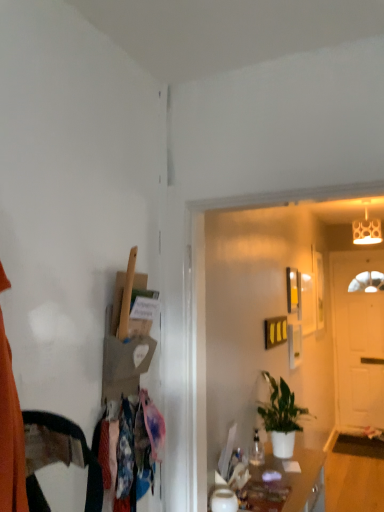
In order to face white matte door at right, should I rotate leftwards or rightwards?

You should rotate right by 21.567 degrees.

This screenshot has height=512, width=384. I want to click on floral fabric dress at left, so click(130, 450).

Describe the element at coordinates (318, 287) in the screenshot. Image resolution: width=384 pixels, height=512 pixels. I see `wooden picture frame at upper right` at that location.

Locate an element on the screen. green matte plant at center is located at coordinates (281, 417).

Find the location of a particular element. This screenshot has height=512, width=384. white matte door at right is located at coordinates (357, 340).

From a real-world perspective, is wooden picture frame at upper right above or below green matte plant at center?

From a real-world perspective, wooden picture frame at upper right is physically above green matte plant at center.

Considering the relative sizes of wooden picture frame at upper right and green matte plant at center in the image provided, is wooden picture frame at upper right taller than green matte plant at center?

Yes, wooden picture frame at upper right is taller than green matte plant at center.

Between wooden picture frame at upper right and green matte plant at center, which one has smaller size?

With smaller size is wooden picture frame at upper right.

Image resolution: width=384 pixels, height=512 pixels. I want to click on houseplant in front of the wooden picture frame at upper right, so (x=281, y=417).

Considering the positions of points (287, 426) and (321, 318), is point (287, 426) farther from camera compared to point (321, 318)?

No, (287, 426) is closer to viewer.

Is green matte plant at center inside or outside of wooden picture frame at upper right?

green matte plant at center lies outside wooden picture frame at upper right.

Is green matte plant at center at the right side of wooden picture frame at upper right?

In fact, green matte plant at center is to the left of wooden picture frame at upper right.

From the image's perspective, is green matte plant at center located above wooden picture frame at upper right?

No, from the image's perspective, green matte plant at center is not above wooden picture frame at upper right.

Is white matte door at right thinner than wooden picture frame at upper right?

In fact, white matte door at right might be wider than wooden picture frame at upper right.

Who is smaller, white matte door at right or wooden picture frame at upper right?

Smaller between the two is wooden picture frame at upper right.

Is wooden picture frame at upper right located within white matte door at right?

No, wooden picture frame at upper right is not surrounded by white matte door at right.

Is point (365, 409) farther from camera compared to point (315, 270)?

That is True.

Who is more distant, matte white cabinet at lower center or floral fabric dress at left?

Positioned behind is matte white cabinet at lower center.

Consider the image. Does matte white cabinet at lower center have a larger size compared to floral fabric dress at left?

Yes, matte white cabinet at lower center is bigger than floral fabric dress at left.

Which point is more forward, (310, 464) or (110, 443)?

The point (110, 443) is more forward.

What's the angular difference between matte white cabinet at lower center and floral fabric dress at left's facing directions?

The angular difference between matte white cabinet at lower center and floral fabric dress at left is 4.68 degrees.

Which of these two, matte white cabinet at lower center or white matte door at right, is bigger?

With larger size is matte white cabinet at lower center.

Which is more to the right, matte white cabinet at lower center or white matte door at right?

From the viewer's perspective, white matte door at right appears more on the right side.

Can you confirm if matte white cabinet at lower center is wider than white matte door at right?

Yes, matte white cabinet at lower center is wider than white matte door at right.

In the scene shown: From a real-world perspective, which is physically below, matte white cabinet at lower center or white matte door at right?

From a 3D spatial view, matte white cabinet at lower center is below.

Is wooden picture frame at upper right turned away from matte white lampshade at upper right?

No.

From a real-world perspective, which object rests below the other?

In real-world perspective, wooden picture frame at upper right is lower.

Between wooden picture frame at upper right and matte white lampshade at upper right, which one appears on the right side from the viewer's perspective?

From the viewer's perspective, matte white lampshade at upper right appears more on the right side.

Based on their positions, is green matte plant at center located to the left or right of matte white cabinet at lower center?

green matte plant at center is to the right of matte white cabinet at lower center.

Based on the photo, from a real-world perspective, which is physically below, green matte plant at center or matte white cabinet at lower center?

In real-world perspective, matte white cabinet at lower center is lower.

Would you say matte white cabinet at lower center is part of green matte plant at center's contents?

No, matte white cabinet at lower center is not surrounded by green matte plant at center.

Which object is thinner, green matte plant at center or matte white cabinet at lower center?

green matte plant at center is thinner.

You are a GUI agent. You are given a task and a screenshot of the screen. Output one action in this format:
    pyautogui.click(x=<x>, y=<y>)
    Task: Click on the picture frame on the right side of green matte plant at center
    
    Given the screenshot: What is the action you would take?
    pyautogui.click(x=318, y=287)

At what (x,y) coordinates should I click in order to perform the action: click on picture frame behind the green matte plant at center. Please return your answer as a coordinate pair (x, y). The width and height of the screenshot is (384, 512). Looking at the image, I should click on (318, 287).

From the image, which object appears to be farther from matte white lampshade at upper right, wooden picture frame at upper right or matte white cabinet at lower center?

Among the two, matte white cabinet at lower center is located further to matte white lampshade at upper right.

Considering their positions, is green matte plant at center positioned further to matte white cabinet at lower center than floral fabric dress at left?

floral fabric dress at left lies further to matte white cabinet at lower center than the other object.

Estimate the real-world distances between objects in this image. Which object is closer to floral fabric dress at left, matte white cabinet at lower center or green matte plant at center?

matte white cabinet at lower center is positioned closer to the anchor floral fabric dress at left.

Which object lies further to the anchor point green matte plant at center, white matte door at right or matte white lampshade at upper right?

The object further to green matte plant at center is white matte door at right.

From the image, which object appears to be farther from green matte plant at center, wooden picture frame at upper right or matte white lampshade at upper right?

matte white lampshade at upper right.

Considering their positions, is floral fabric dress at left positioned further to green matte plant at center than matte white cabinet at lower center?

The object further to green matte plant at center is floral fabric dress at left.

Estimate the real-world distances between objects in this image. Which object is closer to matte white lampshade at upper right, green matte plant at center or wooden picture frame at upper right?

Based on the image, wooden picture frame at upper right appears to be nearer to matte white lampshade at upper right.

When comparing their distances from green matte plant at center, does white matte door at right or matte white cabinet at lower center seem further?

Based on the image, white matte door at right appears to be further to green matte plant at center.

The width and height of the screenshot is (384, 512). In order to click on lamp between matte white cabinet at lower center and wooden picture frame at upper right in the front-back direction in this screenshot , I will do `click(366, 231)`.

The height and width of the screenshot is (512, 384). Identify the location of cabinetry between floral fabric dress at left and white matte door at right in the front-back direction. (296, 476).

Locate an element on the screen. The width and height of the screenshot is (384, 512). cabinetry between floral fabric dress at left and green matte plant at center in the front-back direction is located at coordinates (296, 476).

Image resolution: width=384 pixels, height=512 pixels. I want to click on picture frame between matte white lampshade at upper right and white matte door at right from top to bottom, so click(x=318, y=287).